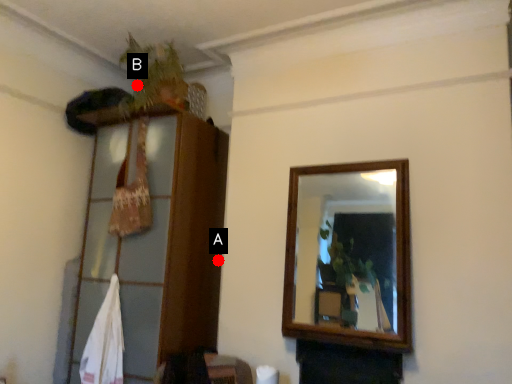
Question: Two points are circled on the image, labeled by A and B beside each circle. Which point is farther from the camera taking this photo?

Choices:
 (A) A is further
 (B) B is further

Answer: (B)